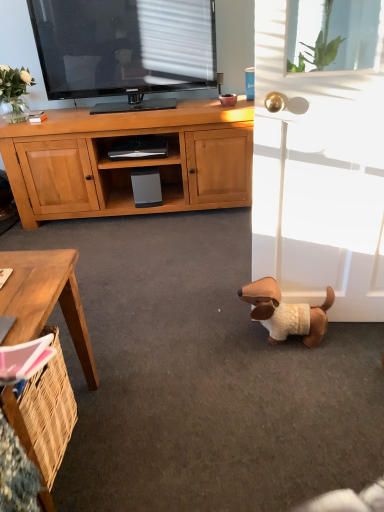
This screenshot has width=384, height=512. What are the coordinates of `free space in front of brown plush dog at lower right` in the screenshot? It's located at (304, 378).